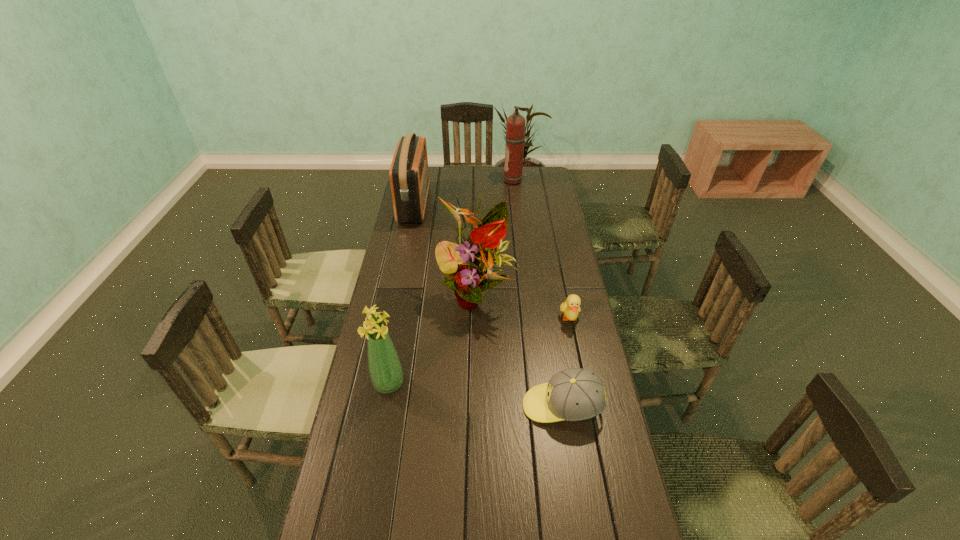
I want to click on fire extinguisher, so click(515, 125).

Find the location of a particular element. the right bouquet is located at coordinates (468, 267).

Where is `the nearer bouquet`? This screenshot has width=960, height=540. the nearer bouquet is located at coordinates (385, 369).

The width and height of the screenshot is (960, 540). What are the coordinates of `radio receiver` in the screenshot? It's located at (409, 174).

Where is `baseball cap`? The height and width of the screenshot is (540, 960). baseball cap is located at coordinates (575, 394).

At what (x,y) coordinates should I click in order to perform the action: click on duckling. Please return your answer as a coordinate pair (x, y). The height and width of the screenshot is (540, 960). Looking at the image, I should click on (571, 307).

Where is `free location located on the side of the fire extinguisher with the label and nozzle`? The width and height of the screenshot is (960, 540). free location located on the side of the fire extinguisher with the label and nozzle is located at coordinates (468, 181).

The image size is (960, 540). Find the location of `free region located 0.180m on the side of the fire extinguisher with the label and nozzle`. free region located 0.180m on the side of the fire extinguisher with the label and nozzle is located at coordinates (469, 181).

Locate an element on the screen. This screenshot has height=540, width=960. free space located 0.210m on the side of the fire extinguisher with the label and nozzle is located at coordinates (464, 181).

Where is `vacant space located 0.220m on the front-facing side of the right bouquet`? The height and width of the screenshot is (540, 960). vacant space located 0.220m on the front-facing side of the right bouquet is located at coordinates (475, 379).